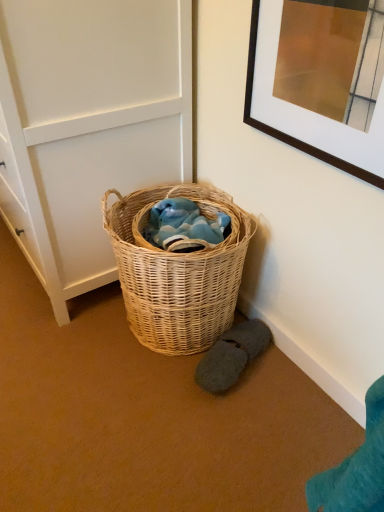
Question: From the image's perspective, is white paneling at center over woven natural basket at center?

Choices:
 (A) yes
 (B) no

Answer: (A)

Question: From the image's perspective, is white paneling at center located beneath woven natural basket at center?

Choices:
 (A) no
 (B) yes

Answer: (A)

Question: Does white paneling at center appear on the left side of woven natural basket at center?

Choices:
 (A) no
 (B) yes

Answer: (B)

Question: Considering the relative sizes of white paneling at center and woven natural basket at center in the image provided, is white paneling at center smaller than woven natural basket at center?

Choices:
 (A) yes
 (B) no

Answer: (B)

Question: Does white paneling at center have a lesser height compared to woven natural basket at center?

Choices:
 (A) no
 (B) yes

Answer: (A)

Question: Does point (125, 309) appear closer or farther from the camera than point (104, 186)?

Choices:
 (A) closer
 (B) farther

Answer: (B)

Question: Relative to white paneling at center, is woven natural basket at center in front or behind?

Choices:
 (A) front
 (B) behind

Answer: (B)

Question: From the image's perspective, relative to white paneling at center, is woven natural basket at center above or below?

Choices:
 (A) above
 (B) below

Answer: (B)

Question: Looking at the image, does woven natural basket at center seem bigger or smaller compared to white paneling at center?

Choices:
 (A) small
 (B) big

Answer: (A)

Question: Looking at the image, does dark gray fuzzy slippers at lower right seem bigger or smaller compared to white paneling at center?

Choices:
 (A) big
 (B) small

Answer: (B)

Question: Visually, is dark gray fuzzy slippers at lower right positioned to the left or to the right of white paneling at center?

Choices:
 (A) left
 (B) right

Answer: (B)

Question: From a real-world perspective, is dark gray fuzzy slippers at lower right above or below white paneling at center?

Choices:
 (A) above
 (B) below

Answer: (B)

Question: Is dark gray fuzzy slippers at lower right in front of or behind white paneling at center in the image?

Choices:
 (A) front
 (B) behind

Answer: (B)

Question: Is dark gray fuzzy slippers at lower right inside the boundaries of woven natural basket at center, or outside?

Choices:
 (A) inside
 (B) outside

Answer: (B)

Question: From a real-world perspective, relative to woven natural basket at center, is dark gray fuzzy slippers at lower right vertically above or below?

Choices:
 (A) above
 (B) below

Answer: (B)